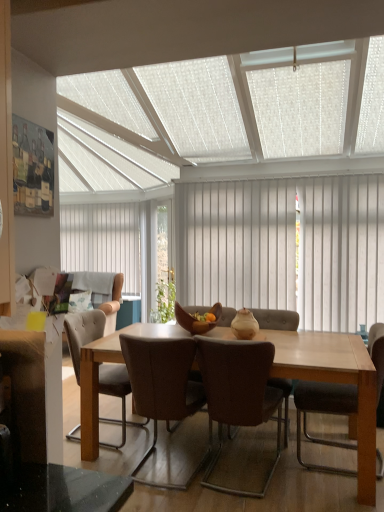
The image size is (384, 512). In order to click on white vertical blinds at center, the first curtain viewed from the left in this screenshot , I will do `click(102, 241)`.

Describe the element at coordinates (324, 413) in the screenshot. I see `brown leather chair at right, which is the 1th chair from right to left` at that location.

This screenshot has width=384, height=512. Describe the element at coordinates (92, 321) in the screenshot. I see `beige fabric couch at left` at that location.

Locate an element on the screen. Image resolution: width=384 pixels, height=512 pixels. light brown wooden table at center is located at coordinates (334, 382).

Can you confirm if light brown wooden table at center is smaller than brown leather chair at right, the 3th chair viewed from the left?

Actually, light brown wooden table at center might be larger than brown leather chair at right, the 3th chair viewed from the left.

Is light brown wooden table at center located outside brown leather chair at right, the 3th chair viewed from the left?

light brown wooden table at center lies outside brown leather chair at right, the 3th chair viewed from the left,'s area.

Is light brown wooden table at center far from brown leather chair at right, the 3th chair viewed from the left?

No.

Between light brown wooden table at center and brown leather chair at right, the 3th chair viewed from the left, which one appears on the right side from the viewer's perspective?

brown leather chair at right, the 3th chair viewed from the left.

From the image's perspective, between brown leather chair at center, which ranks as the 2th chair in left-to-right order, and brown leather chair at right, which is the 1th chair from right to left, which one is located above?

brown leather chair at right, which is the 1th chair from right to left.

Is brown leather chair at center, which is counted as the 2th chair, starting from the right, thinner than brown leather chair at right, which is the 1th chair from right to left?

Incorrect, the width of brown leather chair at center, which is counted as the 2th chair, starting from the right, is not less than that of brown leather chair at right, which is the 1th chair from right to left.

From a real-world perspective, is brown leather chair at center, which is counted as the 2th chair, starting from the right, below brown leather chair at right, the 3th chair viewed from the left?

Correct, in the physical world, brown leather chair at center, which is counted as the 2th chair, starting from the right, is lower than brown leather chair at right, the 3th chair viewed from the left.

Is there a large distance between brown leather chair at center, which ranks as the 2th chair in left-to-right order, and brown leather chair at right, the 3th chair viewed from the left?

No, brown leather chair at center, which ranks as the 2th chair in left-to-right order, is not far away from brown leather chair at right, the 3th chair viewed from the left.

From the image's perspective, is white vertical blinds at center, the first curtain viewed from the right, located above or below leather at center, the first chair from the left?

white vertical blinds at center, the first curtain viewed from the right, is situated higher than leather at center, the first chair from the left, in the image.

In the scene shown: From a real-world perspective, is white vertical blinds at center, the second curtain positioned from the left, located beneath leather at center, the first chair from the left?

No, from a real-world perspective, white vertical blinds at center, the second curtain positioned from the left, is not below leather at center, the first chair from the left.

What's the angular difference between white vertical blinds at center, the first curtain viewed from the right, and leather at center, the first chair from the left,'s facing directions?

white vertical blinds at center, the first curtain viewed from the right, and leather at center, the first chair from the left, are facing 180 degrees away from each other.

How far apart are white vertical blinds at center, the second curtain positioned from the left, and leather at center, which is counted as the third chair, starting from the right?

white vertical blinds at center, the second curtain positioned from the left, and leather at center, which is counted as the third chair, starting from the right, are 5.17 feet apart from each other.

Considering the sizes of objects white fabric pillow at left and white vertical blinds at center, the 2th curtain when ordered from right to left, in the image provided, who is thinner, white fabric pillow at left or white vertical blinds at center, the 2th curtain when ordered from right to left,?

white vertical blinds at center, the 2th curtain when ordered from right to left.

This screenshot has height=512, width=384. What are the coordinates of `curtain that is the 2nd one when counting upward from the white fabric pillow at left (from the image's perspective)` in the screenshot? It's located at (102, 241).

Is white fabric pillow at left facing towards white vertical blinds at center, which appears as the 1th curtain when viewed from the back?

No, white fabric pillow at left is not oriented towards white vertical blinds at center, which appears as the 1th curtain when viewed from the back.

Is white fabric pillow at left in front of or behind white vertical blinds at center, the first curtain viewed from the left, in the image?

Visually, white fabric pillow at left is located in front of white vertical blinds at center, the first curtain viewed from the left.

Considering the points (209, 484) and (81, 297), which point is behind, point (209, 484) or point (81, 297)?

The point (81, 297) is farther from the camera.

Is brown leather chair at center, which is counted as the 2th chair, starting from the right, positioned far away from white fabric pillow at left?

Yes.

Image resolution: width=384 pixels, height=512 pixels. Identify the location of pillow above the brown leather chair at center, which ranks as the 2th chair in left-to-right order (from the image's perspective). (80, 301).

Does white textured ceiling at upper center have a smaller size compared to brown leather chair at center, which ranks as the 2th chair in left-to-right order?

No.

Does white textured ceiling at upper center turn towards brown leather chair at center, which ranks as the 2th chair in left-to-right order?

No, white textured ceiling at upper center is not turned towards brown leather chair at center, which ranks as the 2th chair in left-to-right order.

Does white textured ceiling at upper center appear on the right side of brown leather chair at center, which ranks as the 2th chair in left-to-right order?

No, white textured ceiling at upper center is not to the right of brown leather chair at center, which ranks as the 2th chair in left-to-right order.

From a real-world perspective, which is physically above, white textured ceiling at upper center or brown leather chair at center, which ranks as the 2th chair in left-to-right order?

From a 3D spatial view, white textured ceiling at upper center is above.

Based on their positions, is brown leather chair at center, which is counted as the 2th chair, starting from the right, located to the left or right of white vertical blinds at center, positioned as the 2th curtain in front-to-back order?

In the image, brown leather chair at center, which is counted as the 2th chair, starting from the right, appears on the right side of white vertical blinds at center, positioned as the 2th curtain in front-to-back order.

Is brown leather chair at center, which is counted as the 2th chair, starting from the right, positioned before white vertical blinds at center, the 2th curtain when ordered from right to left?

Yes, brown leather chair at center, which is counted as the 2th chair, starting from the right, is closer to the camera.

Is brown leather chair at center, which is counted as the 2th chair, starting from the right, facing towards white vertical blinds at center, which appears as the 1th curtain when viewed from the back?

No, brown leather chair at center, which is counted as the 2th chair, starting from the right, is not turned towards white vertical blinds at center, which appears as the 1th curtain when viewed from the back.

Considering the sizes of objects brown leather chair at center, which is counted as the 2th chair, starting from the right, and white vertical blinds at center, positioned as the 2th curtain in front-to-back order, in the image provided, who is wider, brown leather chair at center, which is counted as the 2th chair, starting from the right, or white vertical blinds at center, positioned as the 2th curtain in front-to-back order,?

Wider between the two is brown leather chair at center, which is counted as the 2th chair, starting from the right.

The image size is (384, 512). I want to click on kitchen & dining room table below the brown leather chair at right, the 3th chair viewed from the left (from the image's perspective), so click(x=334, y=382).

The height and width of the screenshot is (512, 384). Identify the location of the 2nd chair directly above the brown leather chair at center, which is counted as the 2th chair, starting from the right (from a real-world perspective). (324, 413).

When comparing their distances from white vertical blinds at center, positioned as the 2th curtain in front-to-back order, does white fabric pillow at left or wooden bowl at center seem closer?

white fabric pillow at left.

From the image, which object appears to be farther from brown leather chair at center, which ranks as the 2th chair in left-to-right order, brown leather chair at right, which is the 1th chair from right to left, or light brown wooden table at center?

brown leather chair at right, which is the 1th chair from right to left, is positioned further to the anchor brown leather chair at center, which ranks as the 2th chair in left-to-right order.

When comparing their distances from white vertical blinds at center, the first curtain viewed from the right, does light brown wooden table at center or leather at center, which is counted as the third chair, starting from the right, seem further?

leather at center, which is counted as the third chair, starting from the right, is positioned further to the anchor white vertical blinds at center, the first curtain viewed from the right.

From the image, which object appears to be nearer to white fabric pillow at left, white vertical blinds at center, marked as the first curtain in a front-to-back arrangement, or brown leather chair at right, which is the 1th chair from right to left?

white vertical blinds at center, marked as the first curtain in a front-to-back arrangement, is positioned closer to the anchor white fabric pillow at left.

Looking at the image, which one is located further to leather at center, the first chair from the left, wooden bowl at center or brown leather chair at right, the 3th chair viewed from the left?

Among the two, brown leather chair at right, the 3th chair viewed from the left, is located further to leather at center, the first chair from the left.

Consider the image. Considering their positions, is beige fabric couch at left positioned further to brown leather chair at right, which is the 1th chair from right to left, than light brown wooden table at center?

Based on the image, beige fabric couch at left appears to be further to brown leather chair at right, which is the 1th chair from right to left.

Estimate the real-world distances between objects in this image. Which object is further from beige fabric couch at left, white textured ceiling at upper center or white vertical blinds at center, positioned as the 2th curtain in front-to-back order?

Among the two, white vertical blinds at center, positioned as the 2th curtain in front-to-back order, is located further to beige fabric couch at left.

Considering their positions, is light brown wooden table at center positioned closer to white textured ceiling at upper center than leather at center, which is counted as the third chair, starting from the right?

Among the two, light brown wooden table at center is located nearer to white textured ceiling at upper center.

I want to click on curtain positioned between wooden bowl at center and white fabric pillow at left from near to far, so click(x=285, y=247).

Find the location of `kitchen & dining room table between wooden bowl at center and brown leather chair at right, which is the 1th chair from right to left, from left to right`. kitchen & dining room table between wooden bowl at center and brown leather chair at right, which is the 1th chair from right to left, from left to right is located at coordinates (334, 382).

Image resolution: width=384 pixels, height=512 pixels. In order to click on curtain positioned between white textured ceiling at upper center and white vertical blinds at center, the 2th curtain when ordered from right to left, from near to far in this screenshot , I will do `click(285, 247)`.

The width and height of the screenshot is (384, 512). I want to click on bowl between white textured ceiling at upper center and light brown wooden table at center vertically, so click(197, 320).